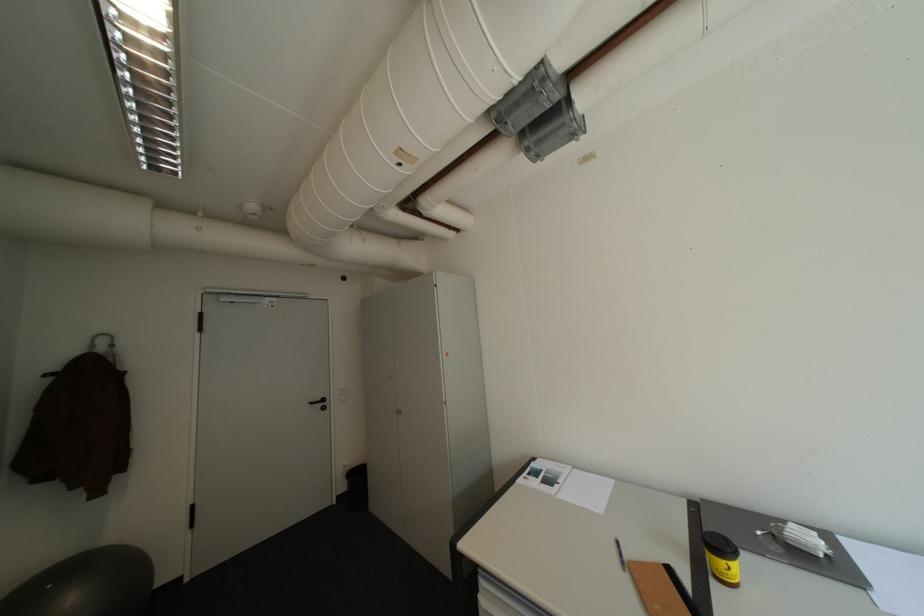
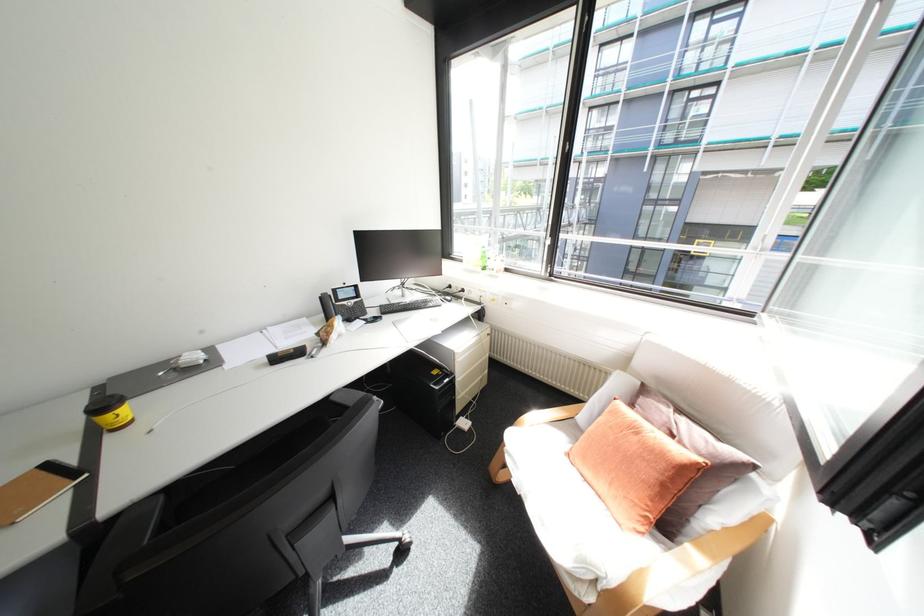
In the second image, find the point that corresponds to (x=699, y=511) in the first image.

(103, 397)